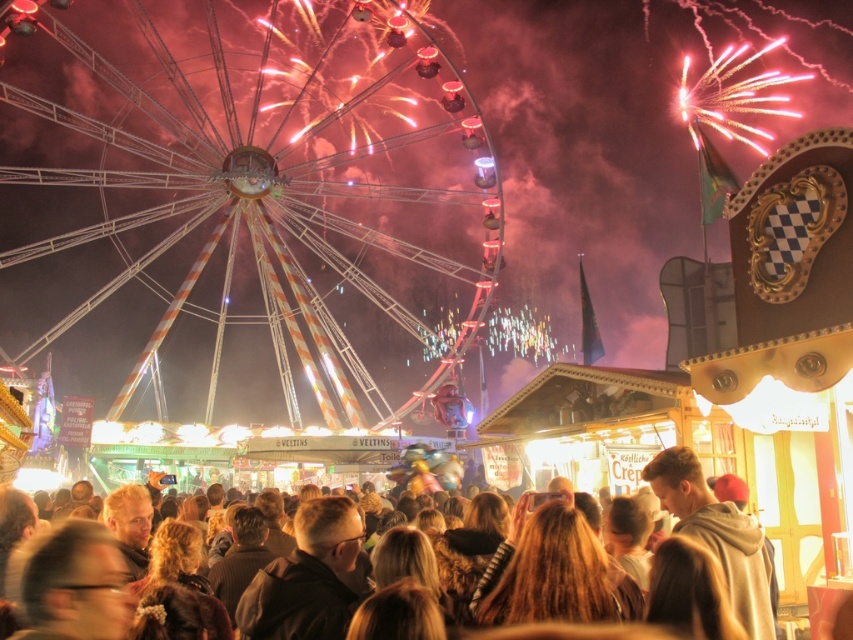
Is metallic ferris wheel at center wider than brown hair at center?

Yes.

Does metallic ferris wheel at center have a greater height compared to brown hair at center?

Yes.

Between point (355, 84) and point (741, 580), which one is positioned in front?

Point (741, 580) is in front.

This screenshot has width=853, height=640. Find the location of `metallic ferris wheel at center`. metallic ferris wheel at center is located at coordinates (265, 173).

Which is below, brown hair at center or light brown hoodie at center?

brown hair at center is lower down.

Locate an element on the screen. brown hair at center is located at coordinates (717, 536).

Where is `brown hair at center`? The width and height of the screenshot is (853, 640). brown hair at center is located at coordinates (717, 536).

Can you confirm if metallic ferris wheel at center is shorter than light brown hoodie at center?

In fact, metallic ferris wheel at center may be taller than light brown hoodie at center.

Who is positioned more to the right, metallic ferris wheel at center or light brown hoodie at center?

Positioned to the right is light brown hoodie at center.

Does point (134, 173) lie behind point (759, 602)?

Yes, it is.

Where is `metallic ferris wheel at center`? This screenshot has height=640, width=853. metallic ferris wheel at center is located at coordinates (265, 173).